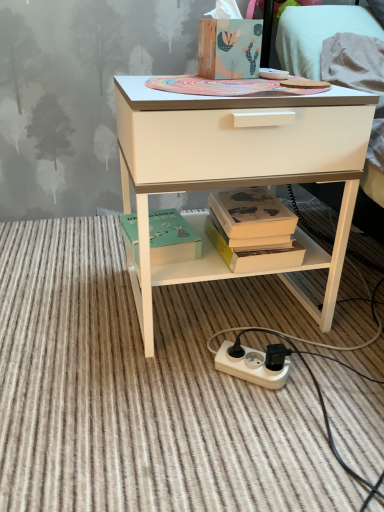
Question: Should I look upward or downward to see wooden tissue box at upper center, the second box from the bottom?

Choices:
 (A) down
 (B) up

Answer: (B)

Question: Is wooden tissue box at upper center, placed as the 2th box when sorted from left to right, at the right side of white plastic power strip at lower center?

Choices:
 (A) no
 (B) yes

Answer: (A)

Question: Could you tell me if wooden tissue box at upper center, positioned as the first box in right-to-left order, is turned towards white plastic power strip at lower center?

Choices:
 (A) yes
 (B) no

Answer: (B)

Question: Is wooden tissue box at upper center, the first box viewed from the top, wider than white plastic power strip at lower center?

Choices:
 (A) yes
 (B) no

Answer: (B)

Question: Is wooden tissue box at upper center, the first box viewed from the top, not near white plastic power strip at lower center?

Choices:
 (A) no
 (B) yes

Answer: (A)

Question: From the image's perspective, is wooden tissue box at upper center, placed as the 2th box when sorted from left to right, over white plastic power strip at lower center?

Choices:
 (A) yes
 (B) no

Answer: (A)

Question: Considering the relative sizes of wooden tissue box at upper center, placed as the 2th box when sorted from left to right, and white plastic power strip at lower center in the image provided, is wooden tissue box at upper center, placed as the 2th box when sorted from left to right, shorter than white plastic power strip at lower center?

Choices:
 (A) no
 (B) yes

Answer: (A)

Question: Does white matte desk at center have a greater width compared to white plastic power strip at lower center?

Choices:
 (A) no
 (B) yes

Answer: (A)

Question: Is white matte desk at center to the right of white plastic power strip at lower center from the viewer's perspective?

Choices:
 (A) yes
 (B) no

Answer: (B)

Question: Does white matte desk at center have a smaller size compared to white plastic power strip at lower center?

Choices:
 (A) yes
 (B) no

Answer: (B)

Question: Can you confirm if white matte desk at center is positioned to the left of white plastic power strip at lower center?

Choices:
 (A) no
 (B) yes

Answer: (B)

Question: Considering the relative sizes of white matte desk at center and white plastic power strip at lower center in the image provided, is white matte desk at center thinner than white plastic power strip at lower center?

Choices:
 (A) no
 (B) yes

Answer: (B)

Question: Is white matte desk at center bigger than white plastic power strip at lower center?

Choices:
 (A) no
 (B) yes

Answer: (B)

Question: Is hardcover book at center far away from wooden tissue box at upper center, the second box from the bottom?

Choices:
 (A) yes
 (B) no

Answer: (B)